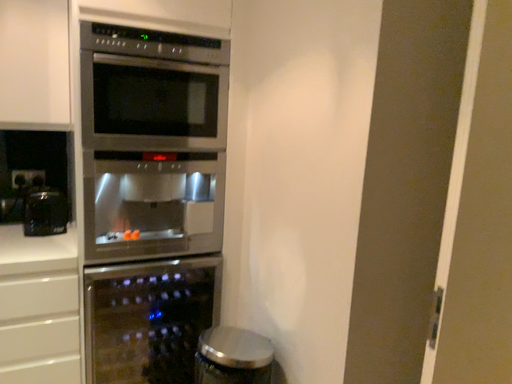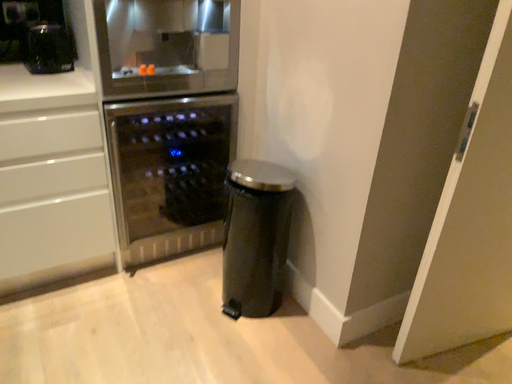
Question: How did the camera likely rotate when shooting the video?

Choices:
 (A) rotated upward
 (B) rotated downward

Answer: (B)